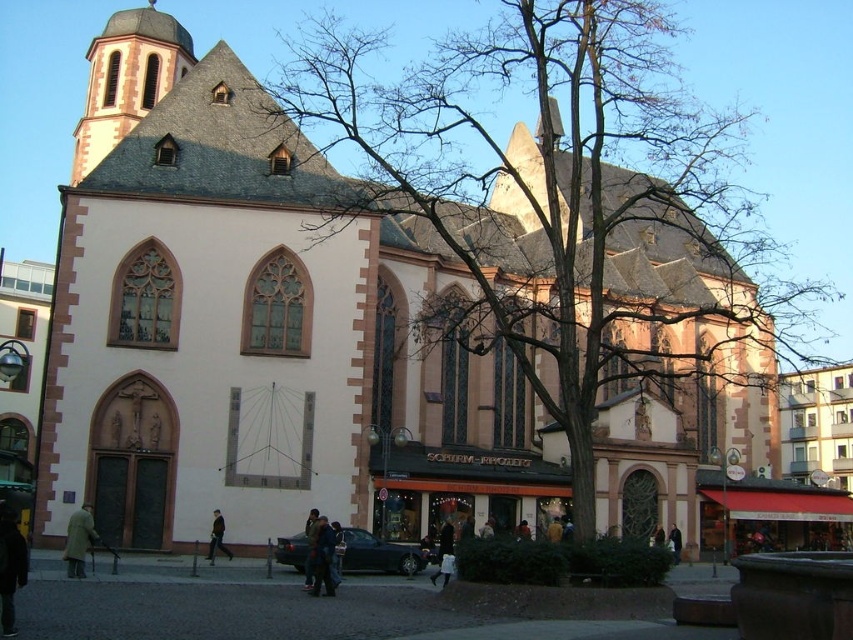
You are standing in front of the historic church and see the bare branches at center and the brown leather coat at lower left. Which object is taller?

The bare branches at center is much taller than the brown leather coat at lower left.

You are standing in front of the historic church and notice the bare branches at center. Based on their position, can you determine if they are closer to the main entrance or the small dome at the top left corner?

The bare branches at center are located at point coordinates closer to the main entrance than the small dome at the top left corner. Therefore, they are closer to the main entrance.